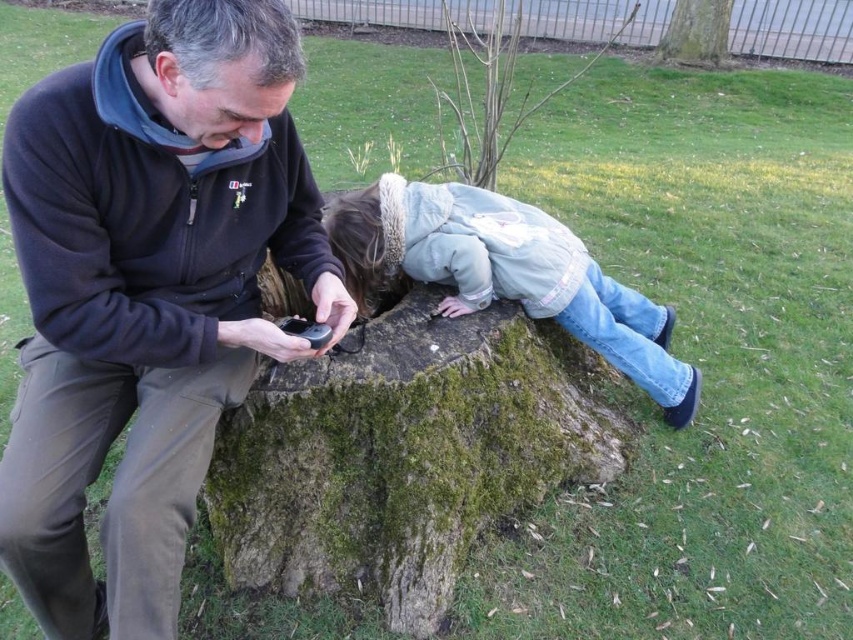
You are a photographer positioned at the edge of the scene. You want to capture a photo that includes both the green mossy stump at center and the light blue denim jeans at center. Which object should you focus on first to ensure both are in frame?

The green mossy stump at center has a greater height compared to the light blue denim jeans at center, so you should focus on the green mossy stump at center first to ensure both are in frame.

You are standing at the point labeled point (404,454) in the image. What is the object located exactly at this point?

The point (404,454) indicates the green mossy stump at center.